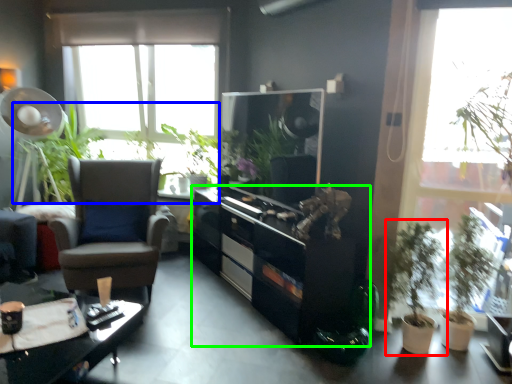
Question: Estimate the real-world distances between objects in this image. Which object is farther from houseplant (highlighted by a red box), vegetation (highlighted by a blue box) or cabinetry (highlighted by a green box)?

Choices:
 (A) vegetation
 (B) cabinetry

Answer: (A)